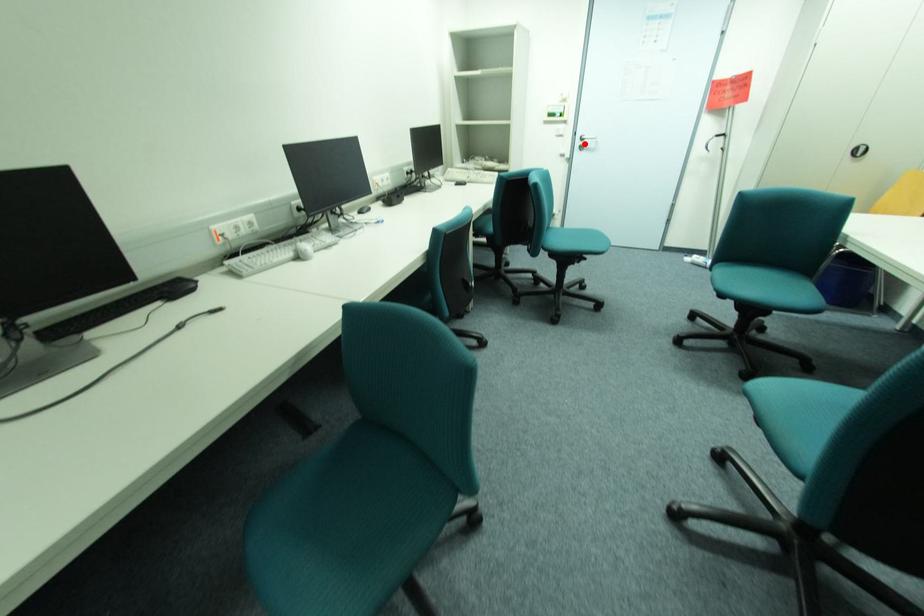
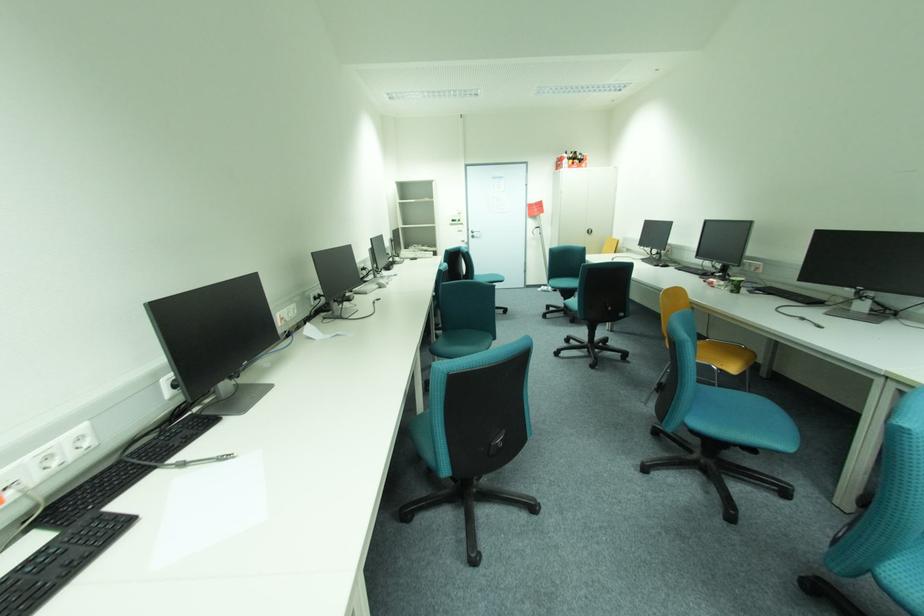
Question: I am providing you with two images of the same scene from different viewpoints. Image1 has a red point marked. In image2, the corresponding 3D location appears at what relative position? Reply with the corresponding letter.

Choices:
 (A) Closer
 (B) Farther

Answer: (B)